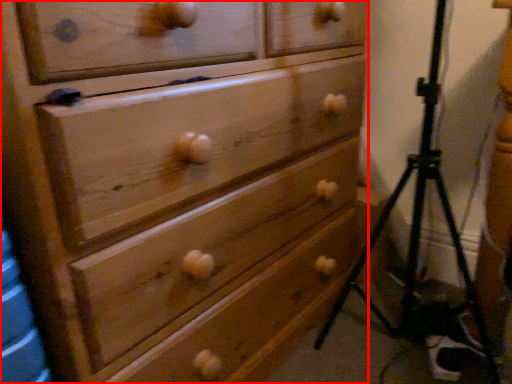
Question: In this image, where is chest of drawers (annotated by the red box) located relative to tripod?

Choices:
 (A) left
 (B) right

Answer: (A)